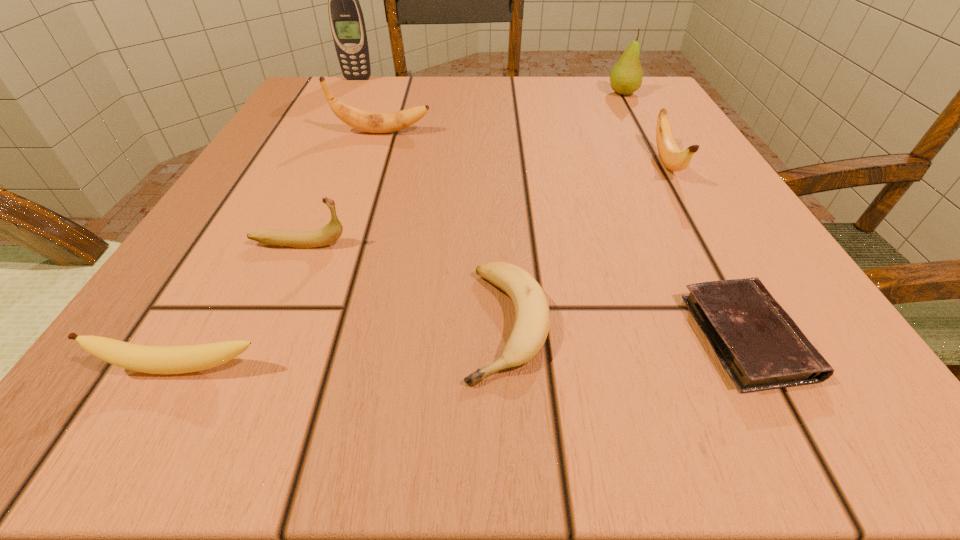
The width and height of the screenshot is (960, 540). I want to click on object present at the near left corner, so click(189, 358).

Locate an element on the screen. The height and width of the screenshot is (540, 960). object that is at the far right corner is located at coordinates (626, 76).

This screenshot has width=960, height=540. I want to click on object at the near right corner, so (759, 345).

This screenshot has height=540, width=960. What are the coordinates of `vacant point at the far edge` in the screenshot? It's located at (552, 91).

The height and width of the screenshot is (540, 960). I want to click on vacant space at the near edge of the desktop, so click(409, 367).

Find the location of `vacant space at the left edge`. vacant space at the left edge is located at coordinates (234, 244).

Identify the location of free spot at the right edge of the desktop. This screenshot has height=540, width=960. (676, 302).

In the image, there is a desktop. What are the coordinates of `vacant space at the far left corner` in the screenshot? It's located at (288, 115).

The height and width of the screenshot is (540, 960). In the image, there is a desktop. What are the coordinates of `vacant space at the far right corner` in the screenshot? It's located at (601, 106).

Find the location of a particular element. This screenshot has width=960, height=540. free spot between the second farthest banana and the shortest banana is located at coordinates pyautogui.click(x=587, y=244).